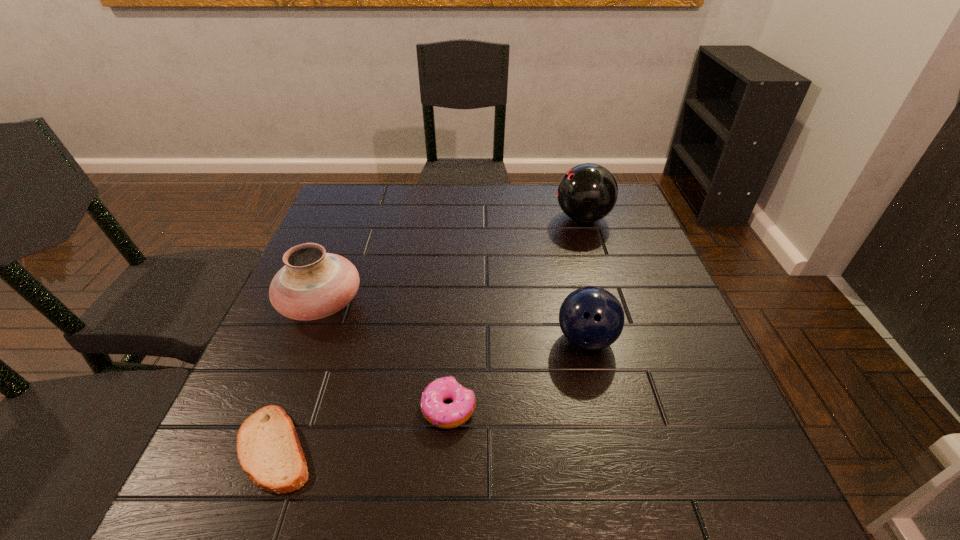
The height and width of the screenshot is (540, 960). What are the coordinates of `the farther bowling ball` in the screenshot? It's located at (588, 192).

Locate an element on the screen. the taller bowling ball is located at coordinates (588, 192).

In order to click on pottery in this screenshot , I will do `click(313, 284)`.

This screenshot has width=960, height=540. I want to click on the nearer bowling ball, so click(x=591, y=318).

You are a GUI agent. You are given a task and a screenshot of the screen. Output one action in this format:
    pyautogui.click(x=<x>, y=<y>)
    Task: Click on the third object from left to right
    This screenshot has width=960, height=540.
    Given the screenshot: What is the action you would take?
    pyautogui.click(x=446, y=416)

Find the location of a particular element. doughnut is located at coordinates (446, 416).

The image size is (960, 540). I want to click on pita bread, so click(268, 448).

Where is `vacant space situated 0.060m on the surface of the farthest object near the finger holes`? The height and width of the screenshot is (540, 960). vacant space situated 0.060m on the surface of the farthest object near the finger holes is located at coordinates (534, 218).

This screenshot has width=960, height=540. What are the coordinates of `free space located 0.340m on the surface of the farthest object near the finger holes` in the screenshot? It's located at (439, 218).

Identify the location of vacant space located 0.170m on the surface of the farthest object near the finger holes. (496, 218).